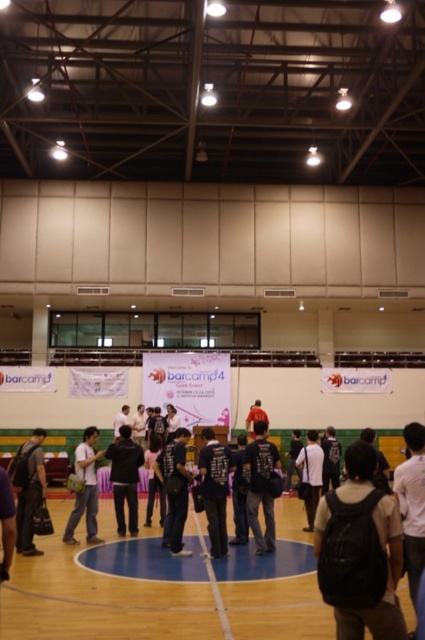
Question: Observing the image, what is the correct spatial positioning of black matte backpack at center in reference to white matte shirt at right?

Choices:
 (A) left
 (B) right

Answer: (A)

Question: Which object is closer to the camera taking this photo?

Choices:
 (A) black matte shirt at center
 (B) dark blue t-shirt at center

Answer: (A)

Question: Which object is the closest to the white matte shirt at right?

Choices:
 (A) matte black backpack at center
 (B) dark gray backpack at left
 (C) white matte shirt at center

Answer: (C)

Question: Which object appears closest to the camera in this image?

Choices:
 (A) dark gray backpack at left
 (B) dark blue t-shirt at center
 (C) black matte backpack at center

Answer: (C)

Question: Is dark blue t-shirt at center closer to the viewer compared to dark blue shirt at center?

Choices:
 (A) no
 (B) yes

Answer: (B)

Question: Is black matte backpack at center thinner than dark gray backpack at center?

Choices:
 (A) no
 (B) yes

Answer: (A)